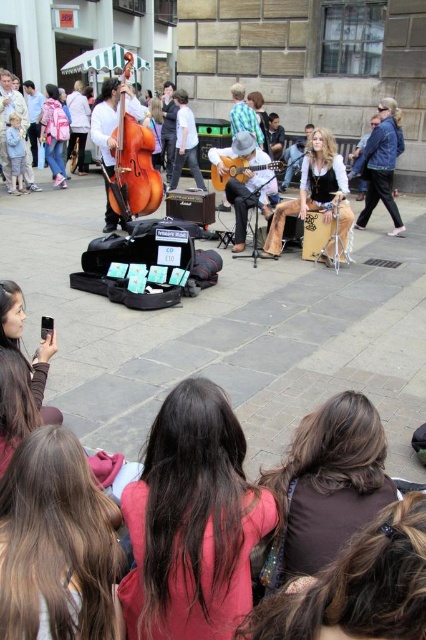
Question: Can you confirm if leather pants at center is thinner than acoustic guitar at center?

Choices:
 (A) no
 (B) yes

Answer: (A)

Question: Among these points, which one is nearest to the camera?

Choices:
 (A) (123, 168)
 (B) (256, 154)
 (C) (259, 164)

Answer: (C)

Question: Can you confirm if orange matte cello at center-left is positioned to the left of acoustic guitar at center?

Choices:
 (A) yes
 (B) no

Answer: (A)

Question: Does wooden acoustic guitar at center have a smaller size compared to acoustic guitar at center?

Choices:
 (A) yes
 (B) no

Answer: (B)

Question: Which object appears closest to the camera in this image?

Choices:
 (A) acoustic guitar at center
 (B) orange matte cello at center-left

Answer: (A)

Question: Which of the following is the farthest from the observer?

Choices:
 (A) (383, 195)
 (B) (279, 168)
 (C) (250, 180)

Answer: (A)